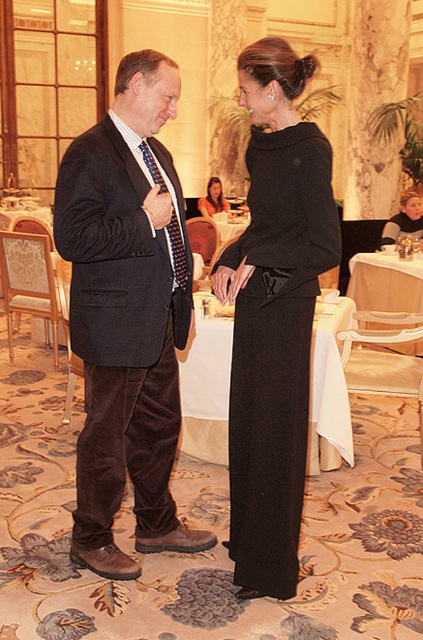
You are a photographer setting up for a formal event. You need to position two subjects wearing the velvet black suit at center and the matte black dress at center so that they are exactly 5 meters apart for a perfect shot. Based on the current setup shown in the image, should you move them closer or farther apart?

The distance between the velvet black suit at center and the matte black dress at center is currently 6.13 meters. Since the desired distance is 5 meters, you should move them closer to reduce the gap.

You are a photographer at a formal event. You need to ensure that the black wool dress at center and the blue textured tie at center are both visible in your photo. Since you can only adjust the camera focus to one of them, which object should you focus on to capture the wider subject?

The black wool dress at center is wider than the blue textured tie at center, so focusing on the black wool dress at center will ensure the wider subject is captured properly.

You are a photographer positioned at the camera. You need to capture a closeup shot of the man adjusting his tie. The focus point for this shot must be precisely at point (x=260, y=362). Given that the minimum focusing distance for your camera is 2.0 meters, will this point be within the camera s focusing range?

The distance between point (x=260, y=362) and the camera is 2.10 meters, which is greater than the minimum focusing distance of 2.0 meters. Therefore, the camera can focus on the point (x=260, y=362) as it is within the focusing range.